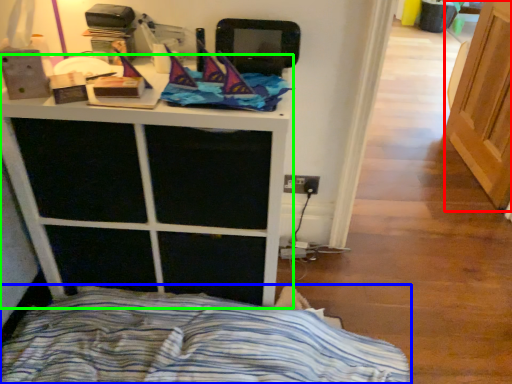
Question: Which is farther away from screen door (highlighted by a red box)? bed (highlighted by a blue box) or furniture (highlighted by a green box)?

Choices:
 (A) bed
 (B) furniture

Answer: (B)